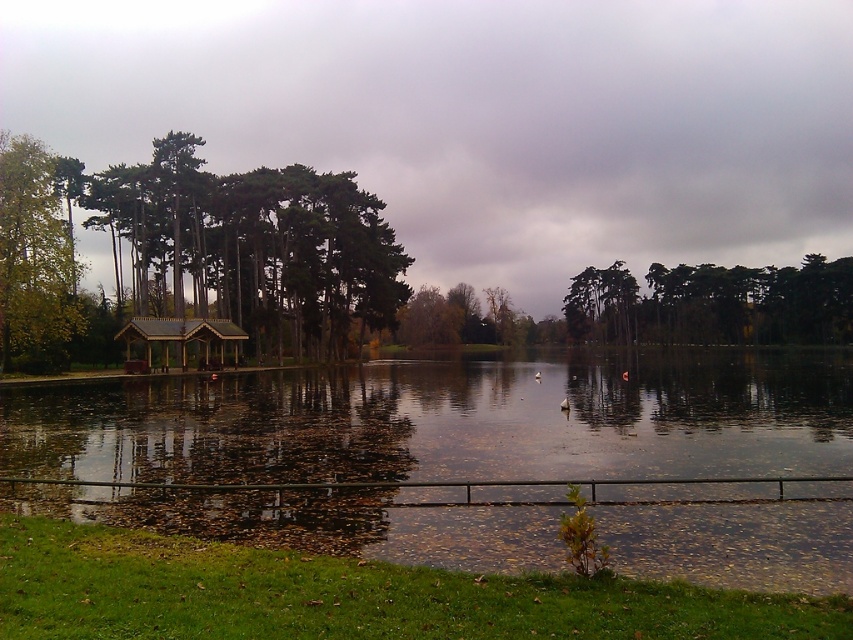
Question: Estimate the real-world distances between objects in this image. Which object is farther from the green textured tree at center?

Choices:
 (A) green matte gazebo at left
 (B) reflective water at center

Answer: (B)

Question: Among these points, which one is nearest to the camera?

Choices:
 (A) pos(231,333)
 (B) pos(68,339)

Answer: (B)

Question: Does green matte trees at center appear on the right side of green textured tree at center?

Choices:
 (A) no
 (B) yes

Answer: (B)

Question: Does green matte trees at center appear under green textured tree at center?

Choices:
 (A) no
 (B) yes

Answer: (A)

Question: Where is reflective water at center located in relation to green textured tree at center in the image?

Choices:
 (A) right
 (B) left

Answer: (B)

Question: Which object appears closest to the camera in this image?

Choices:
 (A) wooden gazebo at center
 (B) reflective water at center
 (C) green leafy tree at left
 (D) green textured tree at center

Answer: (B)